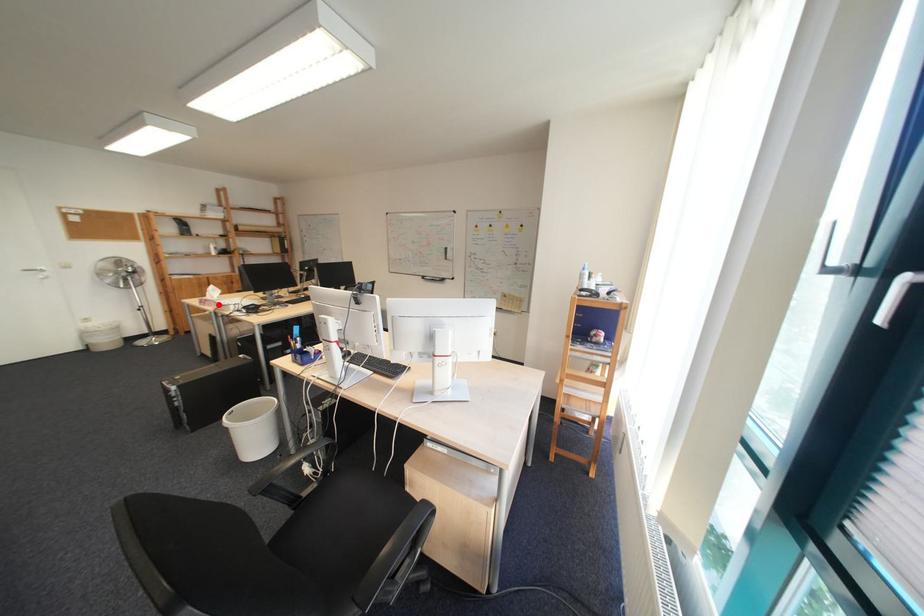
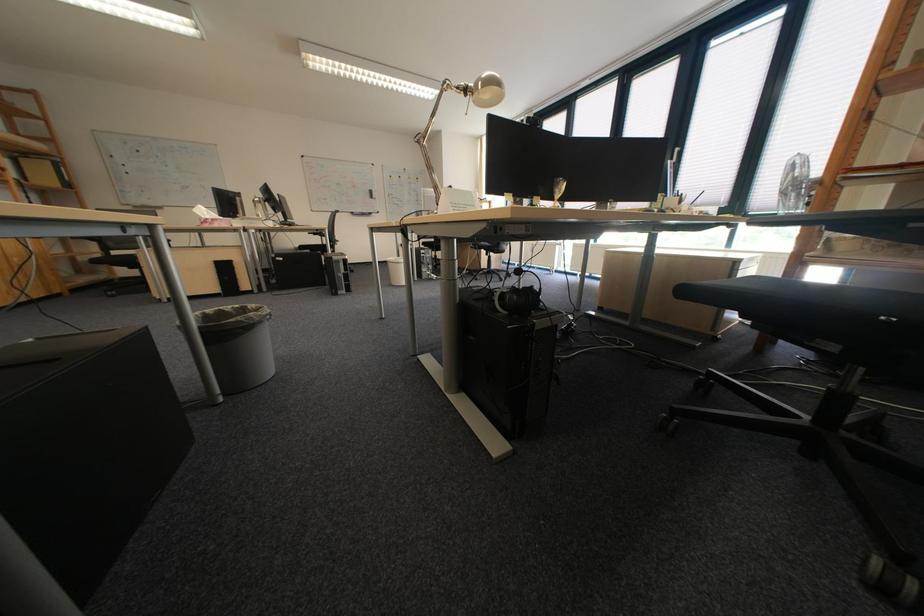
Locate, in the second image, the point that corresponds to the highlighted location in the first image.

(225, 225)